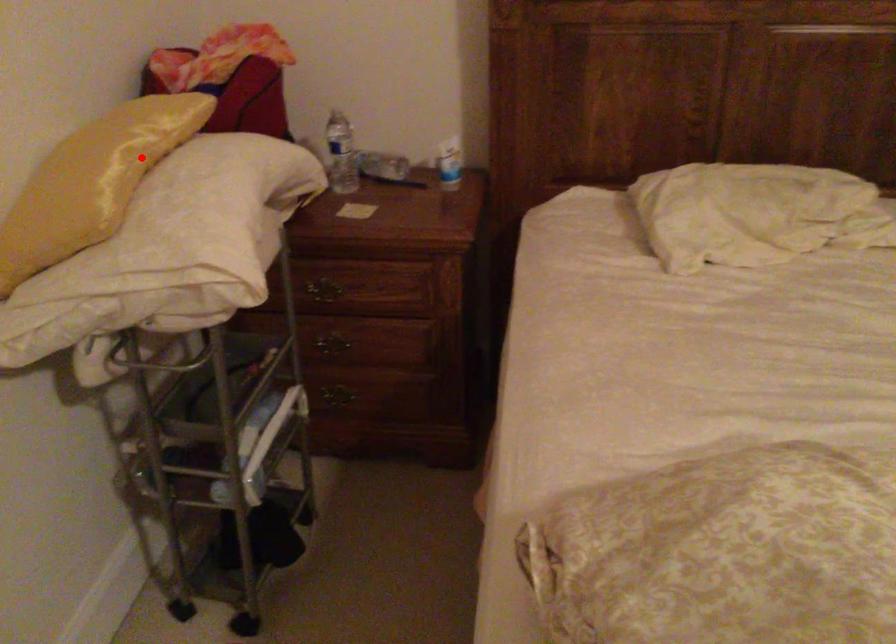
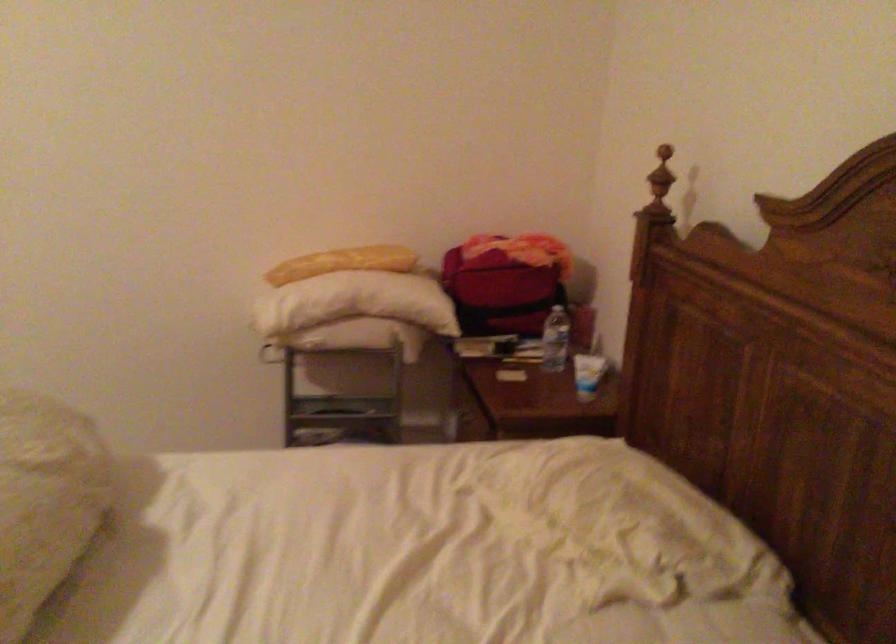
Where in the second image is the point corresponding to the highlighted location from the first image?

(342, 263)